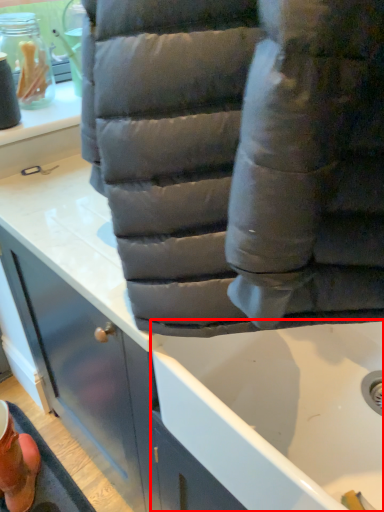
Question: In this image, where is bath (annotated by the red box) located relative to footwear?

Choices:
 (A) left
 (B) right

Answer: (B)